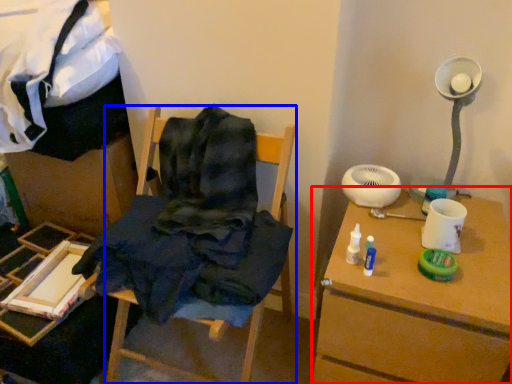
Question: Which object appears closest to the camera in this image, table (highlighted by a red box) or furniture (highlighted by a blue box)?

Choices:
 (A) table
 (B) furniture

Answer: (B)